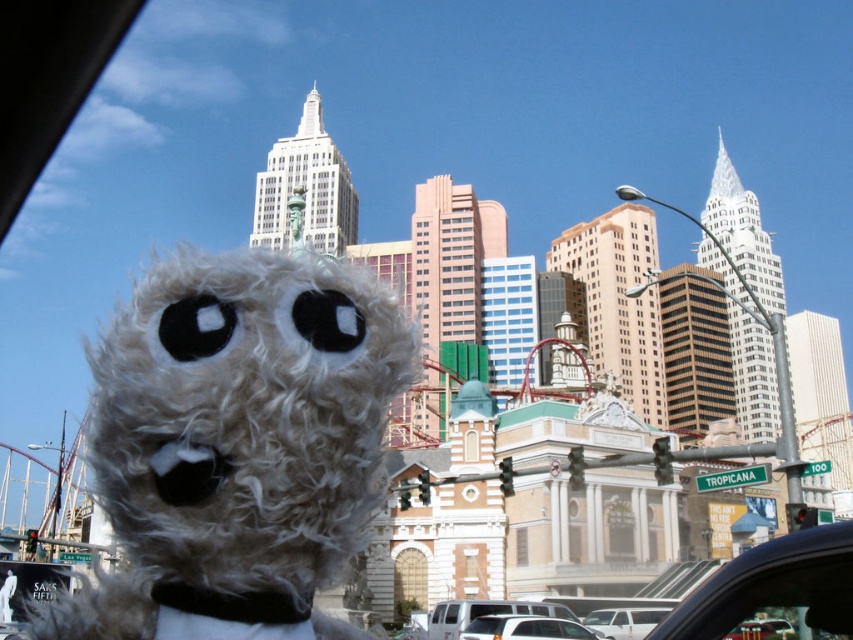
You are a passenger in a car and see the fluffy white stuffed animal at center and the white matte car at lower center through the window. Which object is closer to you?

The fluffy white stuffed animal at center is closer to the viewer than the white matte car at lower center.

You are a passenger in a car and want to know if the fluffy white stuffed animal at center is bigger than the white matte car at lower center. Can you confirm this?

The fluffy white stuffed animal at center has a larger size compared to the white matte car at lower center, so yes, the stuffed animal is bigger than the car.

You are a delivery driver who needs to place a package between the fluffy white stuffed animal at center and the car window. The package is 10 feet long. Can you fit it between them without moving the stuffed animal?

The distance between the fluffy white stuffed animal at center and the car window is 83.84 feet. Since the package is only 10 feet long, it can easily fit between them without moving the stuffed animal.